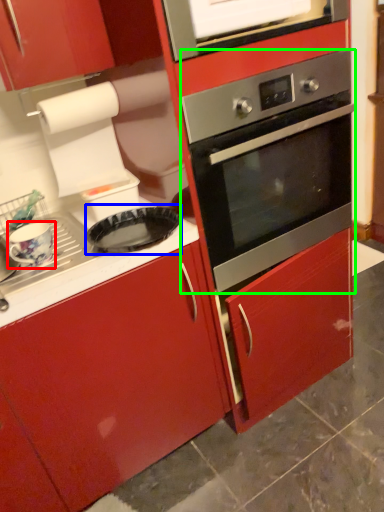
Question: Which is nearer to the appliance (highlighted by a red box)? pizza pan (highlighted by a blue box) or oven (highlighted by a green box).

Choices:
 (A) pizza pan
 (B) oven

Answer: (A)